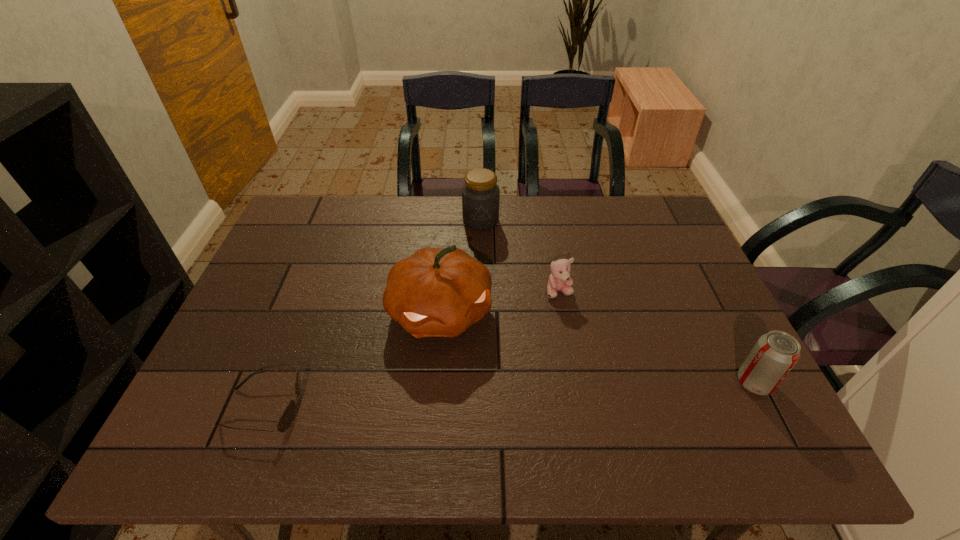
Identify the location of sunglasses at the near edge. (286, 419).

Find the location of a particular element. The height and width of the screenshot is (540, 960). soda can that is positioned at the near edge is located at coordinates (773, 356).

Where is `object that is at the left edge`? object that is at the left edge is located at coordinates (286, 419).

You are a GUI agent. You are given a task and a screenshot of the screen. Output one action in this format:
    pyautogui.click(x=<x>, y=<y>)
    Task: Click on the object located in the right edge section of the desktop
    
    Given the screenshot: What is the action you would take?
    pyautogui.click(x=773, y=356)

Locate an element on the screen. object that is positioned at the near left corner is located at coordinates (286, 419).

I want to click on object present at the near right corner, so click(x=773, y=356).

Image resolution: width=960 pixels, height=540 pixels. What are the coordinates of `free space at the far edge of the desktop` in the screenshot? It's located at (373, 197).

Find the location of a particular element. free space at the near edge of the desktop is located at coordinates (473, 387).

In the image, there is a desktop. Where is `vacant space at the left edge`? vacant space at the left edge is located at coordinates 286,303.

In the image, there is a desktop. Where is `free space at the right edge`? Image resolution: width=960 pixels, height=540 pixels. free space at the right edge is located at coordinates (669, 273).